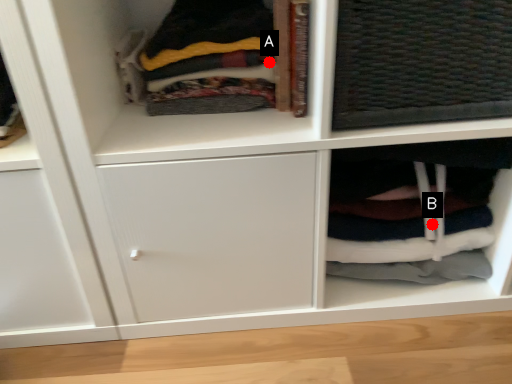
Question: Two points are circled on the image, labeled by A and B beside each circle. Which point is closer to the camera?

Choices:
 (A) A is closer
 (B) B is closer

Answer: (A)